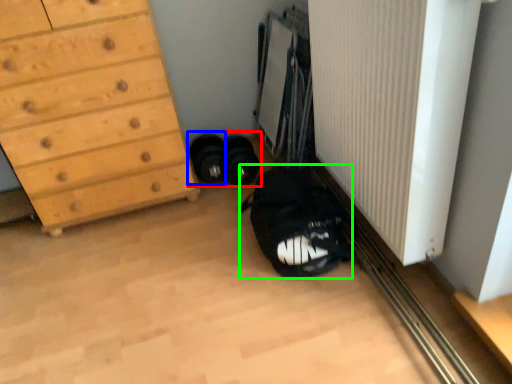
Question: Based on their relative distances, which object is nearer to footwear (highlighted by a red box)? Choose from footwear (highlighted by a blue box) and shoulder bag (highlighted by a green box).

Choices:
 (A) footwear
 (B) shoulder bag

Answer: (A)